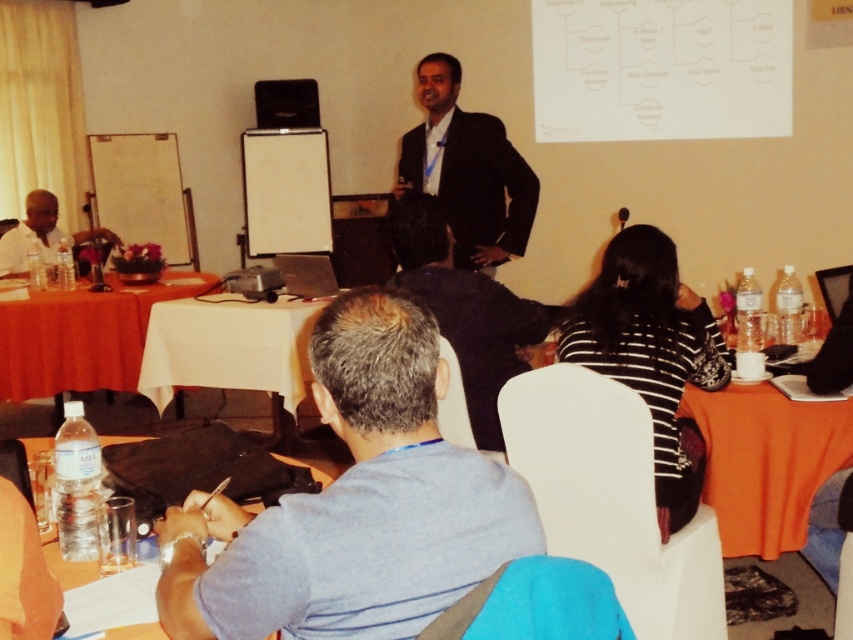
Identify the location of gray fabric shirt at center. (357, 502).

Is gray fabric shirt at center below white cloth-covered table at center?

Indeed, gray fabric shirt at center is positioned under white cloth-covered table at center.

Between point (376, 344) and point (241, 376), which one is positioned in front?

Point (376, 344) is more forward.

Identify the location of gray fabric shirt at center. (357, 502).

Is black matte suit at center closer to camera compared to orange fabric table at lower left?

Yes, it is in front of orange fabric table at lower left.

Identify the location of black matte suit at center. (467, 170).

In the scene shown: Who is positioned more to the left, gray fabric shirt at center or clear plastic water bottle at lower left?

From the viewer's perspective, clear plastic water bottle at lower left appears more on the left side.

Between gray fabric shirt at center and clear plastic water bottle at lower left, which one is positioned lower?

Positioned lower is clear plastic water bottle at lower left.

You are a GUI agent. You are given a task and a screenshot of the screen. Output one action in this format:
    pyautogui.click(x=<x>, y=<y>)
    Task: Click on the gray fabric shirt at center
    
    Given the screenshot: What is the action you would take?
    pyautogui.click(x=357, y=502)

The width and height of the screenshot is (853, 640). Find the location of `gray fabric shirt at center`. gray fabric shirt at center is located at coordinates (357, 502).